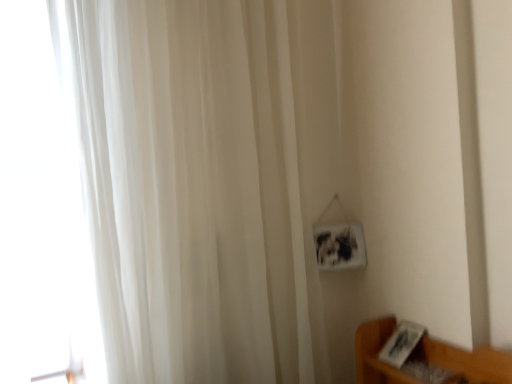
Measure the distance between transparent glass door at left and camera.

They are 38.87 inches apart.

The height and width of the screenshot is (384, 512). Describe the element at coordinates (42, 205) in the screenshot. I see `transparent glass door at left` at that location.

Locate an element on the screen. transparent glass door at left is located at coordinates (42, 205).

This screenshot has height=384, width=512. Describe the element at coordinates (207, 183) in the screenshot. I see `white sheer curtain at left` at that location.

Find the location of a particular element. Image resolution: width=512 pixels, height=384 pixels. white sheer curtain at left is located at coordinates (207, 183).

Where is `transparent glass door at left`? This screenshot has height=384, width=512. transparent glass door at left is located at coordinates (42, 205).

Which object is positioned more to the right, white sheer curtain at left or transparent glass door at left?

white sheer curtain at left is more to the right.

Considering the relative positions of white sheer curtain at left and transparent glass door at left in the image provided, is white sheer curtain at left in front of transparent glass door at left?

Yes, white sheer curtain at left is closer to the camera.

Considering the points (186, 269) and (24, 370), which point is in front, point (186, 269) or point (24, 370)?

The point (24, 370) is closer.

Looking at this image, from the image's perspective, does white sheer curtain at left appear higher than transparent glass door at left?

No, from the image's perspective, white sheer curtain at left is not above transparent glass door at left.

From a real-world perspective, which object stands above the other?

In real-world perspective, transparent glass door at left is above.

Between white sheer curtain at left and transparent glass door at left, which one has smaller width?

With smaller width is transparent glass door at left.

Considering the relative sizes of white sheer curtain at left and transparent glass door at left in the image provided, is white sheer curtain at left shorter than transparent glass door at left?

In fact, white sheer curtain at left may be taller than transparent glass door at left.

Considering the sizes of objects white sheer curtain at left and transparent glass door at left in the image provided, who is bigger, white sheer curtain at left or transparent glass door at left?

white sheer curtain at left.

Is transparent glass door at left surrounded by white sheer curtain at left?

No.

Are white sheer curtain at left and transparent glass door at left making contact?

white sheer curtain at left and transparent glass door at left are not in contact.

Is white sheer curtain at left oriented towards transparent glass door at left?

No, white sheer curtain at left is not aimed at transparent glass door at left.

Identify the location of glass door on the left of white sheer curtain at left. (42, 205).

Based on the photo, which is more to the left, transparent glass door at left or white sheer curtain at left?

Positioned to the left is transparent glass door at left.

Is the depth of transparent glass door at left less than that of white sheer curtain at left?

No, transparent glass door at left is behind white sheer curtain at left.

Is point (29, 131) positioned after point (266, 57)?

No, (29, 131) is closer to viewer.

From the image's perspective, does transparent glass door at left appear lower than white sheer curtain at left?

No, from the image's perspective, transparent glass door at left is not beneath white sheer curtain at left.

From a real-world perspective, relative to white sheer curtain at left, is transparent glass door at left vertically above or below?

Clearly, from a real-world perspective, transparent glass door at left is above white sheer curtain at left.

In terms of width, does transparent glass door at left look wider or thinner when compared to white sheer curtain at left?

Clearly, transparent glass door at left has less width compared to white sheer curtain at left.

In terms of height, does transparent glass door at left look taller or shorter compared to white sheer curtain at left?

Considering their sizes, transparent glass door at left has less height than white sheer curtain at left.

Considering the relative sizes of transparent glass door at left and white sheer curtain at left in the image provided, is transparent glass door at left smaller than white sheer curtain at left?

Yes, transparent glass door at left is smaller than white sheer curtain at left.

Is white sheer curtain at left completely or partially inside transparent glass door at left?

No, white sheer curtain at left is located outside of transparent glass door at left.

Is transparent glass door at left not near white sheer curtain at left?

No, there isn't a large distance between transparent glass door at left and white sheer curtain at left.

Is transparent glass door at left oriented towards white sheer curtain at left?

Yes, transparent glass door at left is aimed at white sheer curtain at left.

The height and width of the screenshot is (384, 512). Identify the location of curtain lying below the transparent glass door at left (from the image's perspective). (207, 183).

Where is `glass door above the white sheer curtain at left (from a real-world perspective)`? glass door above the white sheer curtain at left (from a real-world perspective) is located at coordinates (42, 205).

This screenshot has width=512, height=384. In order to click on curtain below the transparent glass door at left (from the image's perspective) in this screenshot , I will do `click(207, 183)`.